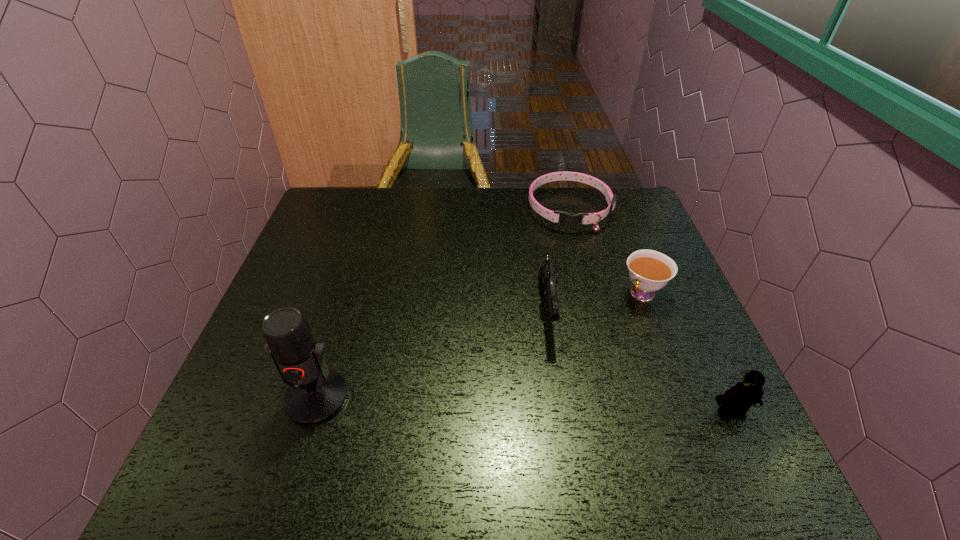
At what (x,y) coordinates should I click in order to perform the action: click on free space on the desktop that is between the microphone and the Lego and is positioned on the side of the teacup with the handle. Please return your answer as a coordinate pair (x, y). Image resolution: width=960 pixels, height=540 pixels. Looking at the image, I should click on (539, 406).

Locate an element on the screen. The image size is (960, 540). vacant space on the desktop that is between the leftmost object and the Lego and is positioned with the buckle on the dog collar is located at coordinates (582, 408).

Image resolution: width=960 pixels, height=540 pixels. In order to click on free spot on the desktop that is between the microphone and the Lego and is positioned at the end of the barrel of the gun in this screenshot , I will do `click(556, 407)`.